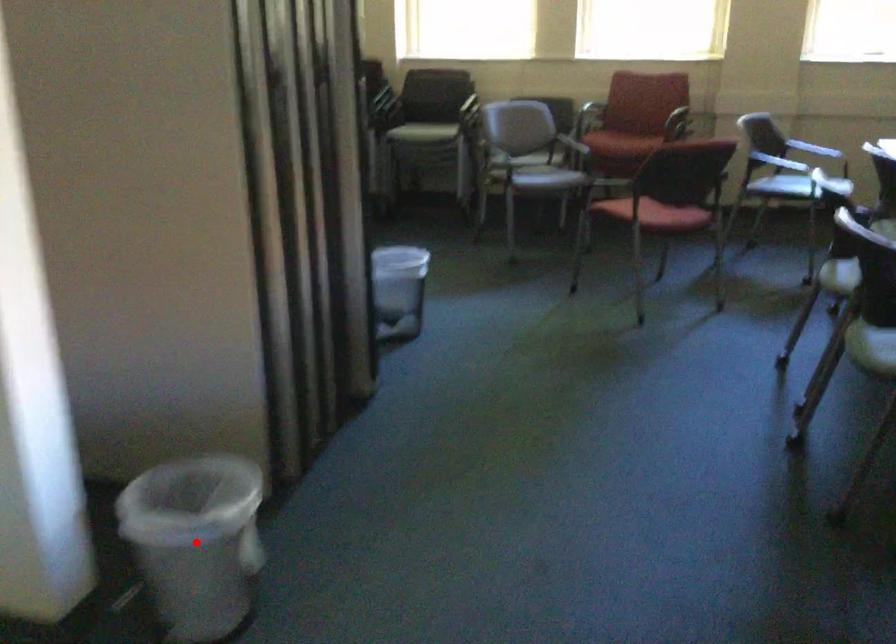
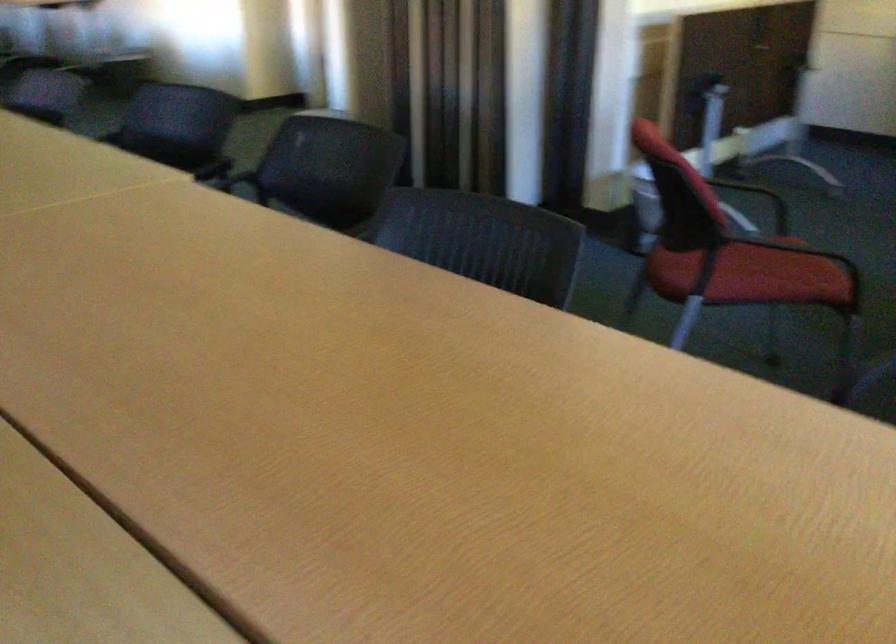
Question: I am providing you with two images of the same scene from different viewpoints. A red point is marked on the first image. Can you still see the location of the red point in image 2?

Choices:
 (A) Yes
 (B) No

Answer: (B)